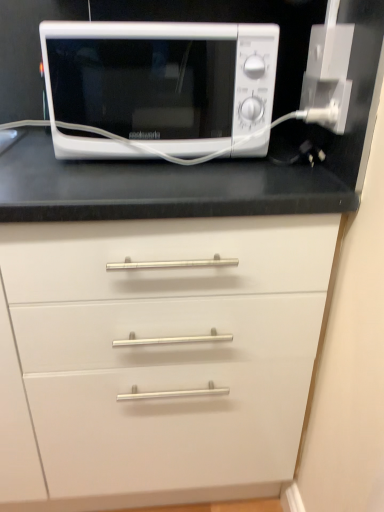
Question: Is white plastic outlet at upper right positioned far away from white matte microwave at upper center?

Choices:
 (A) yes
 (B) no

Answer: (B)

Question: Can you confirm if white plastic outlet at upper right is shorter than white matte microwave at upper center?

Choices:
 (A) no
 (B) yes

Answer: (B)

Question: Is the position of white plastic outlet at upper right more distant than that of white matte microwave at upper center?

Choices:
 (A) no
 (B) yes

Answer: (B)

Question: Considering the relative sizes of white plastic outlet at upper right and white matte microwave at upper center in the image provided, is white plastic outlet at upper right wider than white matte microwave at upper center?

Choices:
 (A) no
 (B) yes

Answer: (A)

Question: From the image's perspective, does white plastic outlet at upper right appear higher than white matte microwave at upper center?

Choices:
 (A) yes
 (B) no

Answer: (B)

Question: Is white plastic outlet at upper right turned away from white matte microwave at upper center?

Choices:
 (A) yes
 (B) no

Answer: (B)

Question: From a real-world perspective, is white matte microwave at upper center under white plastic outlet at upper right?

Choices:
 (A) no
 (B) yes

Answer: (A)

Question: Would you consider white matte microwave at upper center to be distant from white plastic outlet at upper right?

Choices:
 (A) no
 (B) yes

Answer: (A)

Question: Is white matte microwave at upper center smaller than white plastic outlet at upper right?

Choices:
 (A) no
 (B) yes

Answer: (A)

Question: Is white matte microwave at upper center oriented towards white plastic outlet at upper right?

Choices:
 (A) no
 (B) yes

Answer: (A)

Question: Is white matte microwave at upper center oriented away from white plastic outlet at upper right?

Choices:
 (A) yes
 (B) no

Answer: (B)

Question: Considering the relative sizes of white matte microwave at upper center and white plastic outlet at upper right in the image provided, is white matte microwave at upper center thinner than white plastic outlet at upper right?

Choices:
 (A) yes
 (B) no

Answer: (B)

Question: Is white plastic outlet at upper right inside or outside of white matte microwave at upper center?

Choices:
 (A) outside
 (B) inside

Answer: (A)